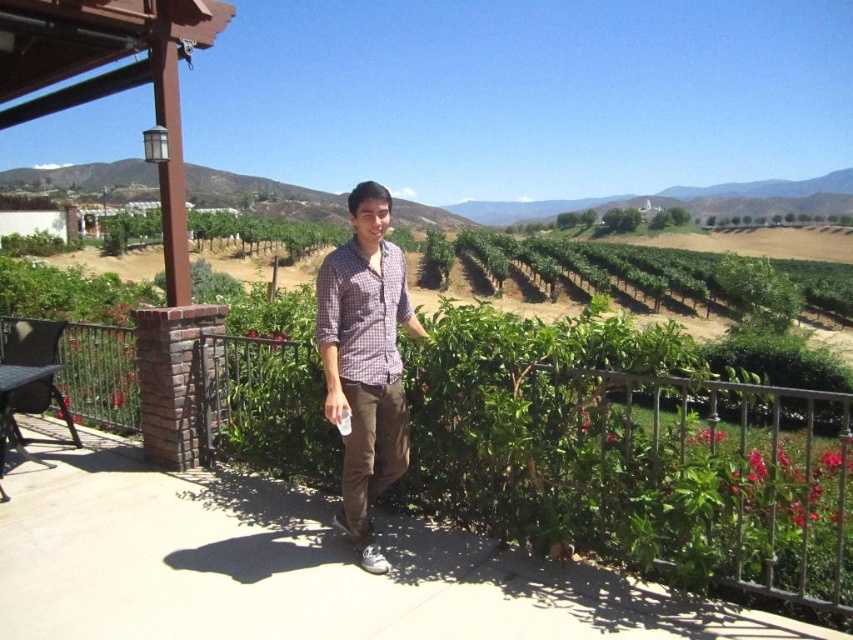
Question: Which point is farther to the camera?

Choices:
 (A) pos(469,348)
 (B) pos(349,285)

Answer: (A)

Question: Is brown concrete porch at center to the right of plaid cotton shirt at center from the viewer's perspective?

Choices:
 (A) yes
 (B) no

Answer: (B)

Question: Which object is farther from the camera taking this photo?

Choices:
 (A) brown concrete porch at center
 (B) plaid cotton shirt at center

Answer: (A)

Question: Is brown concrete porch at center wider than plaid cotton shirt at center?

Choices:
 (A) yes
 (B) no

Answer: (B)

Question: Does brown concrete porch at center have a lesser width compared to plaid cotton shirt at center?

Choices:
 (A) yes
 (B) no

Answer: (A)